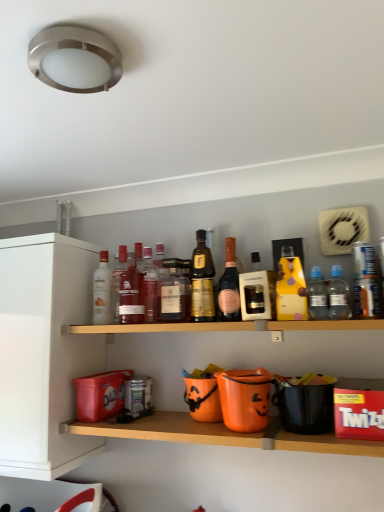
Question: Considering the relative positions of gold metallic bottle at center, which is counted as the 4th bottle, starting from the right, and clear plastic bottle at center right, placed as the 2th bottle when sorted from right to left, in the image provided, is gold metallic bottle at center, which is counted as the 4th bottle, starting from the right, in front of clear plastic bottle at center right, placed as the 2th bottle when sorted from right to left,?

Choices:
 (A) no
 (B) yes

Answer: (A)

Question: From a real-world perspective, is gold metallic bottle at center, which ranks as the 6th bottle in left-to-right order, located higher than clear plastic bottle at center right, placed as the 2th bottle when sorted from right to left?

Choices:
 (A) no
 (B) yes

Answer: (B)

Question: Is the surface of gold metallic bottle at center, which is counted as the 4th bottle, starting from the right, in direct contact with clear plastic bottle at center right, which appears as the 8th bottle when viewed from the left?

Choices:
 (A) yes
 (B) no

Answer: (B)

Question: Is clear plastic bottle at center right, placed as the 2th bottle when sorted from right to left, completely or partially inside gold metallic bottle at center, which is counted as the 4th bottle, starting from the right?

Choices:
 (A) no
 (B) yes

Answer: (A)

Question: Considering the relative sizes of gold metallic bottle at center, which ranks as the 6th bottle in left-to-right order, and clear plastic bottle at center right, placed as the 2th bottle when sorted from right to left, in the image provided, is gold metallic bottle at center, which ranks as the 6th bottle in left-to-right order, shorter than clear plastic bottle at center right, placed as the 2th bottle when sorted from right to left,?

Choices:
 (A) yes
 (B) no

Answer: (B)

Question: Looking at their shapes, would you say matte glass bottle at center, acting as the second bottle starting from the left, is wider or thinner than pink glass bottle at center, which ranks as the seventh bottle in left-to-right order?

Choices:
 (A) thin
 (B) wide

Answer: (B)

Question: In the image, is matte glass bottle at center, acting as the second bottle starting from the left, on the left side or the right side of pink glass bottle at center, which ranks as the seventh bottle in left-to-right order?

Choices:
 (A) left
 (B) right

Answer: (A)

Question: Does point (117, 264) appear closer or farther from the camera than point (231, 251)?

Choices:
 (A) farther
 (B) closer

Answer: (A)

Question: From a real-world perspective, is matte glass bottle at center, marked as the eighth bottle in a right-to-left arrangement, physically located above or below pink glass bottle at center, the third bottle positioned from the right?

Choices:
 (A) above
 (B) below

Answer: (A)

Question: Is matte glass bottle at center, acting as the second bottle starting from the left, in front of or behind orange plastic buckets at lower center, the 1th shelf ordered from the bottom, in the image?

Choices:
 (A) behind
 (B) front

Answer: (A)

Question: Is matte glass bottle at center, marked as the eighth bottle in a right-to-left arrangement, bigger or smaller than orange plastic buckets at lower center, the 1th shelf ordered from the bottom?

Choices:
 (A) small
 (B) big

Answer: (A)

Question: From the image's perspective, relative to orange plastic buckets at lower center, the 1th shelf ordered from the bottom, is matte glass bottle at center, acting as the second bottle starting from the left, above or below?

Choices:
 (A) above
 (B) below

Answer: (A)

Question: Considering the positions of matte glass bottle at center, marked as the eighth bottle in a right-to-left arrangement, and orange plastic buckets at lower center, acting as the second shelf starting from the top, in the image, is matte glass bottle at center, marked as the eighth bottle in a right-to-left arrangement, wider or thinner than orange plastic buckets at lower center, acting as the second shelf starting from the top,?

Choices:
 (A) wide
 (B) thin

Answer: (B)

Question: Choose the correct answer: Is gold metallic bottle at center, which is counted as the 4th bottle, starting from the right, inside pink glass bottle at center, which ranks as the seventh bottle in left-to-right order, or outside it?

Choices:
 (A) outside
 (B) inside

Answer: (A)

Question: Considering the relative positions of gold metallic bottle at center, which ranks as the 6th bottle in left-to-right order, and pink glass bottle at center, the third bottle positioned from the right, in the image provided, is gold metallic bottle at center, which ranks as the 6th bottle in left-to-right order, to the left or to the right of pink glass bottle at center, the third bottle positioned from the right,?

Choices:
 (A) left
 (B) right

Answer: (A)